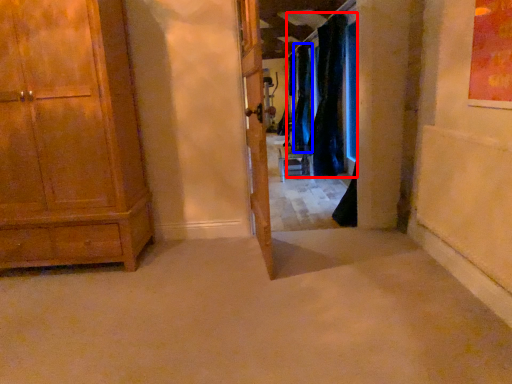
Question: Which of the following is the closest to the observer, curtain (highlighted by a red box) or curtain (highlighted by a blue box)?

Choices:
 (A) curtain
 (B) curtain

Answer: (A)